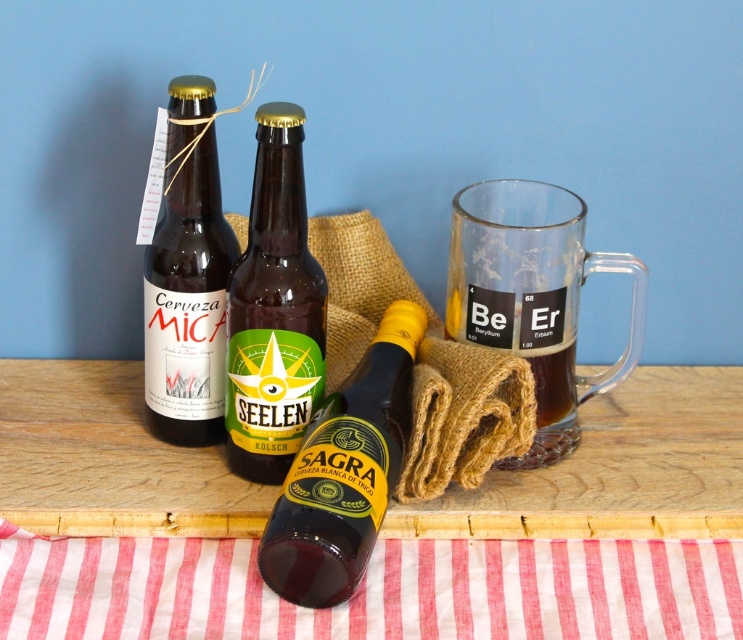
Question: Estimate the real-world distances between objects in this image. Which object is farther from the transparent glass mug at right?

Choices:
 (A) matte glass bottle at upper left
 (B) green matte bottle at center
 (C) red striped fabric at lower center

Answer: (A)

Question: Is matte glass bottle at upper left positioned behind green matte bottle at center?

Choices:
 (A) no
 (B) yes

Answer: (B)

Question: Which object is the farthest from the shiny brown bottle at center?

Choices:
 (A) wooden table at center
 (B) matte glass bottle at upper left
 (C) transparent glass mug at right

Answer: (B)

Question: Can you confirm if wooden table at center is smaller than red striped fabric at lower center?

Choices:
 (A) no
 (B) yes

Answer: (A)

Question: Can you confirm if shiny brown bottle at center is positioned above green matte bottle at center?

Choices:
 (A) yes
 (B) no

Answer: (B)

Question: Which object is the farthest from the transparent glass mug at right?

Choices:
 (A) matte glass bottle at upper left
 (B) wooden table at center
 (C) green matte bottle at center

Answer: (A)